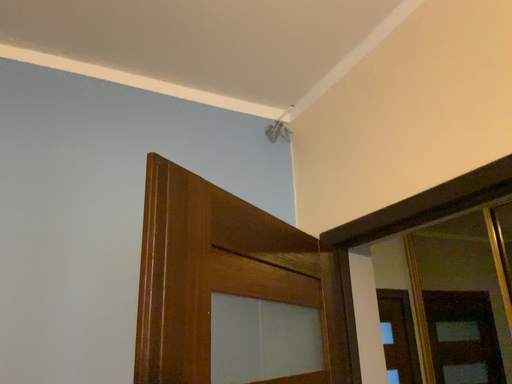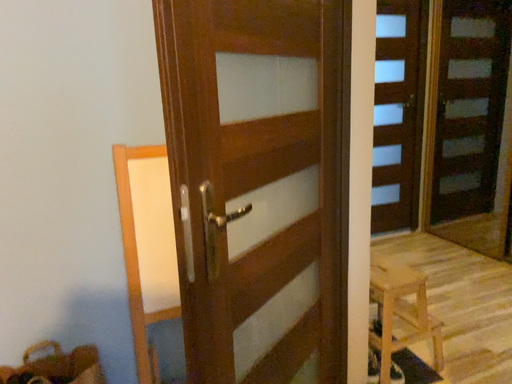
Question: How did the camera likely rotate when shooting the video?

Choices:
 (A) rotated downward
 (B) rotated upward

Answer: (A)